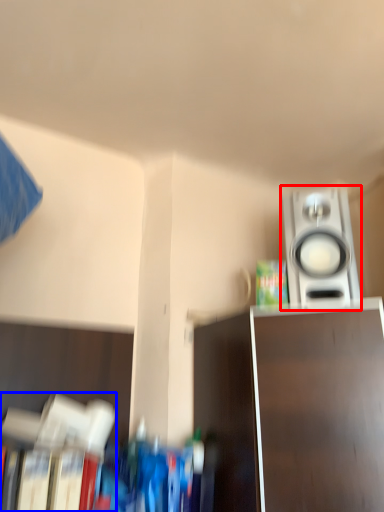
Question: Which point is further to the camera, home appliance (highlighted by a red box) or book (highlighted by a blue box)?

Choices:
 (A) home appliance
 (B) book

Answer: (A)